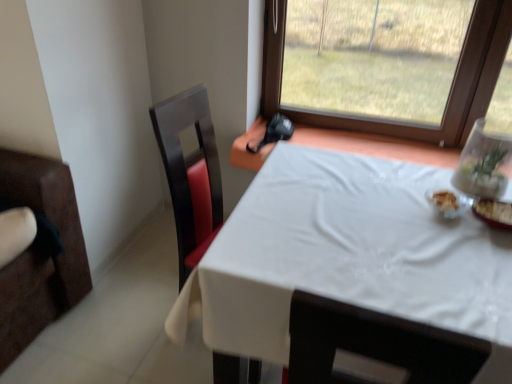
Locate an element on the screen. The image size is (512, 384). free space above white cloth-covered table at center (from a real-world perspective) is located at coordinates (375, 236).